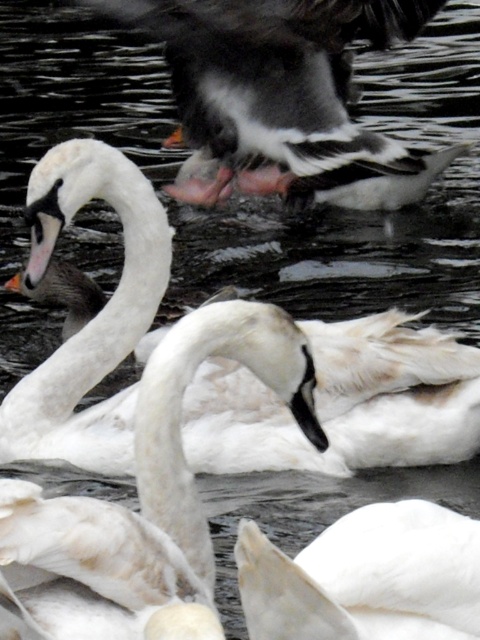
You are observing the swans in the water. Which swan, the white matte swan at center or the white feathered swan at center, is closer to you?

The white matte swan at center is positioned over the white feathered swan at center, so the white matte swan at center is closer to you.

You are a photographer trying to capture both the white matte swan at center and the white feathered swan at center in a single shot. Based on their positions, which swan do you think will appear larger in the photo?

The white matte swan at center might appear larger than the white feathered swan at center because it is wider according to the description.